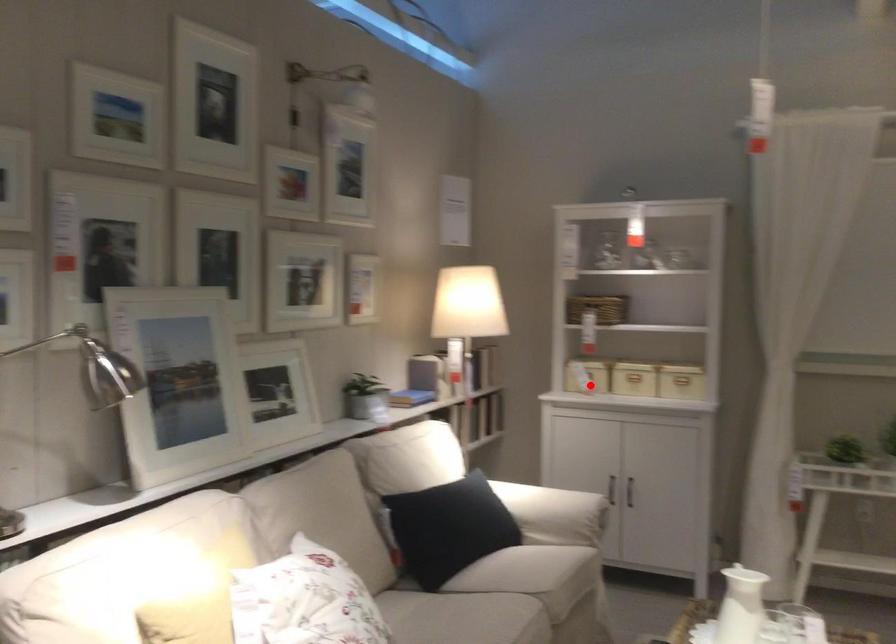
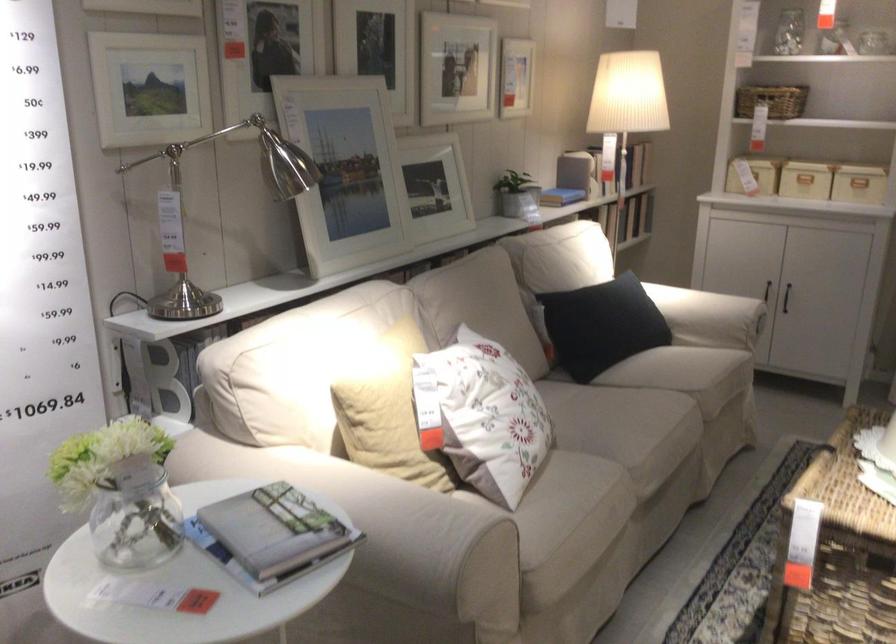
The point at the highlighted location is marked in the first image. Where is the corresponding point in the second image?

(753, 175)